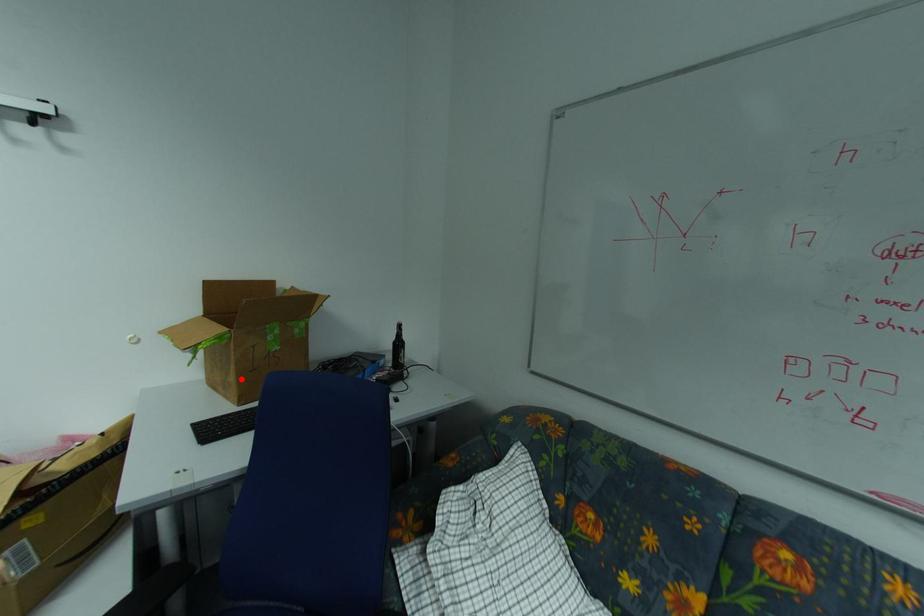
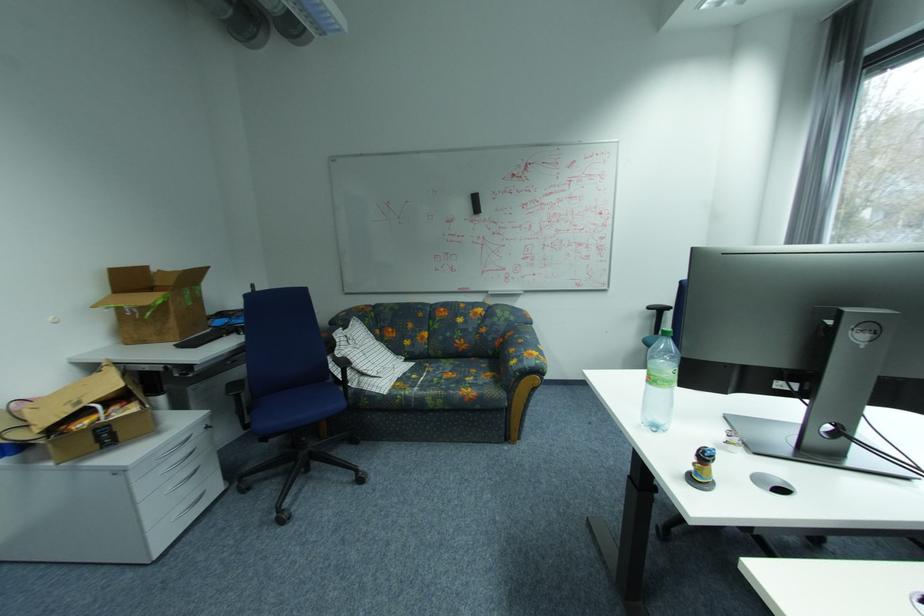
The point at the highlighted location is marked in the first image. Where is the corresponding point in the second image?

(180, 323)